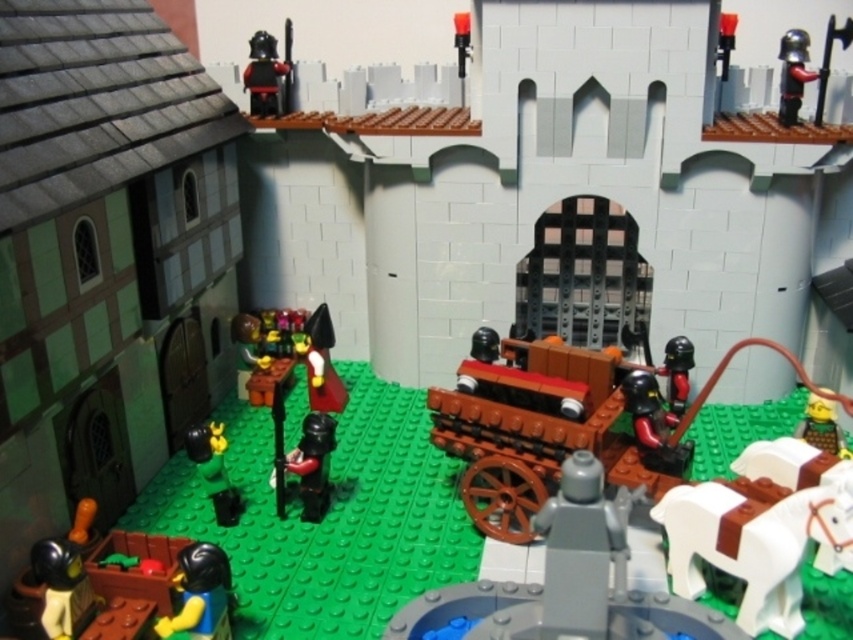
Does shiny black helmet at upper left have a smaller size compared to shiny black cape at center?

Yes, shiny black helmet at upper left is smaller than shiny black cape at center.

Is shiny black helmet at upper left to the left of shiny black cape at center from the viewer's perspective?

Correct, you'll find shiny black helmet at upper left to the left of shiny black cape at center.

Who is more distant from viewer, [270,54] or [320,404]?

The point [270,54] is more distant.

What are the coordinates of `shiny black helmet at upper left` in the screenshot? It's located at (267, 74).

Between white matte horse at lower right and green matte figure at lower left, which one is positioned lower?

white matte horse at lower right

The width and height of the screenshot is (853, 640). Find the location of `white matte horse at lower right`. white matte horse at lower right is located at coordinates (762, 529).

Where is `white matte horse at lower right`? This screenshot has height=640, width=853. white matte horse at lower right is located at coordinates (762, 529).

Can you confirm if brown matte cannon at center is positioned above shiny black helmet at center?

Indeed, brown matte cannon at center is positioned over shiny black helmet at center.

Does brown matte cannon at center come behind shiny black helmet at center?

No, brown matte cannon at center is in front of shiny black helmet at center.

Who is more forward, (511, 376) or (320, 496)?

Point (511, 376) is in front.

The height and width of the screenshot is (640, 853). I want to click on brown matte cannon at center, so click(548, 426).